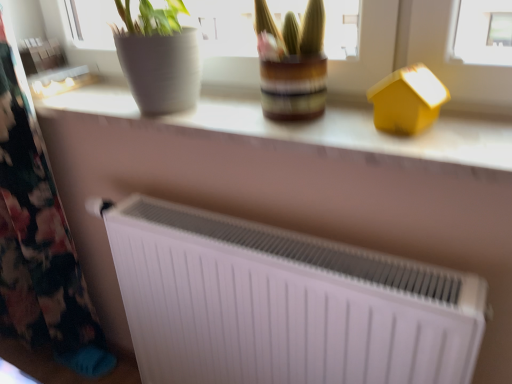
Question: Can you confirm if white matte radiator at center is bigger than yellow matte house at upper right?

Choices:
 (A) yes
 (B) no

Answer: (A)

Question: Is white matte radiator at center outside yellow matte house at upper right?

Choices:
 (A) yes
 (B) no

Answer: (A)

Question: From a real-world perspective, does white matte radiator at center stand above yellow matte house at upper right?

Choices:
 (A) yes
 (B) no

Answer: (B)

Question: Is white matte radiator at center shorter than yellow matte house at upper right?

Choices:
 (A) no
 (B) yes

Answer: (B)

Question: Is white matte radiator at center directly adjacent to yellow matte house at upper right?

Choices:
 (A) no
 (B) yes

Answer: (A)

Question: Considering the positions of yellow matte house at upper right and white matte radiator at lower center in the image, is yellow matte house at upper right taller or shorter than white matte radiator at lower center?

Choices:
 (A) short
 (B) tall

Answer: (A)

Question: Is yellow matte house at upper right inside the boundaries of white matte radiator at lower center, or outside?

Choices:
 (A) outside
 (B) inside

Answer: (A)

Question: Does point (417, 119) appear closer or farther from the camera than point (252, 281)?

Choices:
 (A) farther
 (B) closer

Answer: (B)

Question: Based on their positions, is yellow matte house at upper right located to the left or right of white matte radiator at lower center?

Choices:
 (A) left
 (B) right

Answer: (B)

Question: In terms of width, does white matte radiator at center look wider or thinner when compared to floral fabric at left?

Choices:
 (A) wide
 (B) thin

Answer: (A)

Question: Does point (265, 124) appear closer or farther from the camera than point (41, 148)?

Choices:
 (A) closer
 (B) farther

Answer: (A)

Question: Relative to floral fabric at left, is white matte radiator at center in front or behind?

Choices:
 (A) behind
 (B) front

Answer: (B)

Question: From the image's perspective, is white matte radiator at center above or below floral fabric at left?

Choices:
 (A) above
 (B) below

Answer: (A)

Question: From the image's perspective, is floral fabric at left located above or below white matte radiator at lower center?

Choices:
 (A) above
 (B) below

Answer: (A)

Question: Choose the correct answer: Is floral fabric at left inside white matte radiator at lower center or outside it?

Choices:
 (A) inside
 (B) outside

Answer: (B)